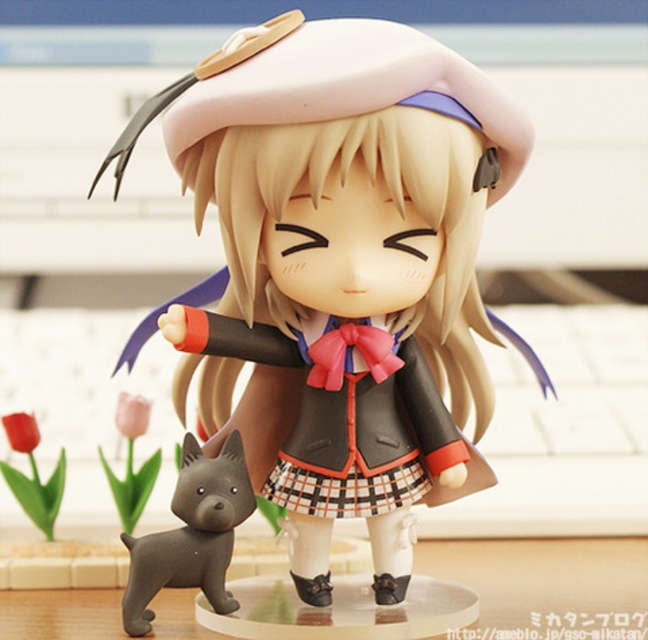
Question: Can you confirm if matte black doll at center is smaller than smooth gray dog at lower left?

Choices:
 (A) yes
 (B) no

Answer: (B)

Question: Based on their relative distances, which object is nearer to the smooth gray dog at lower left?

Choices:
 (A) matte black doll at center
 (B) plaid fabric dress at center

Answer: (B)

Question: Can you confirm if plaid fabric dress at center is bigger than smooth gray dog at lower left?

Choices:
 (A) no
 (B) yes

Answer: (B)

Question: Estimate the real-world distances between objects in this image. Which object is farther from the matte black doll at center?

Choices:
 (A) smooth gray dog at lower left
 (B) plaid fabric dress at center

Answer: (A)

Question: Is plaid fabric dress at center further to the viewer compared to smooth gray dog at lower left?

Choices:
 (A) no
 (B) yes

Answer: (B)

Question: Estimate the real-world distances between objects in this image. Which object is closer to the plaid fabric dress at center?

Choices:
 (A) smooth gray dog at lower left
 (B) matte black doll at center

Answer: (A)